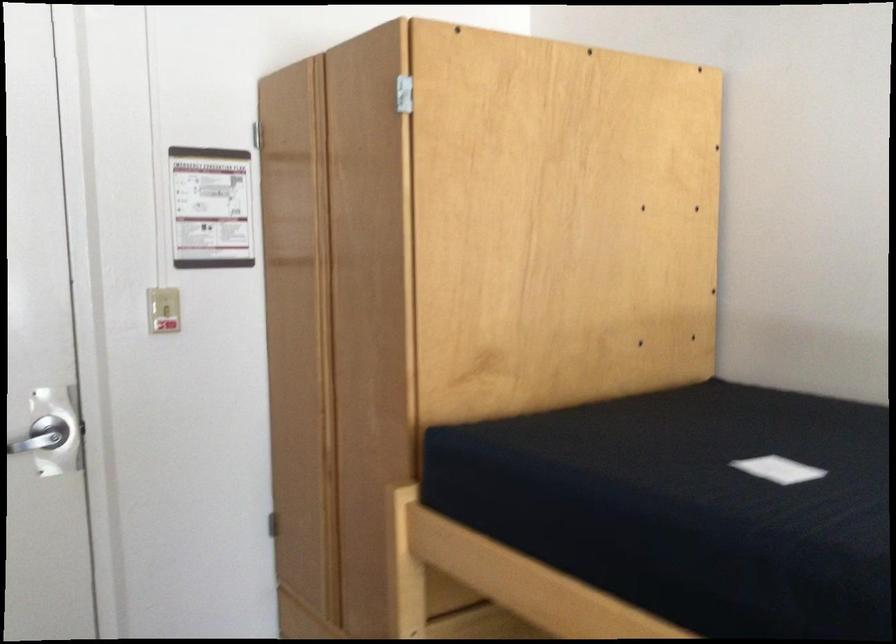
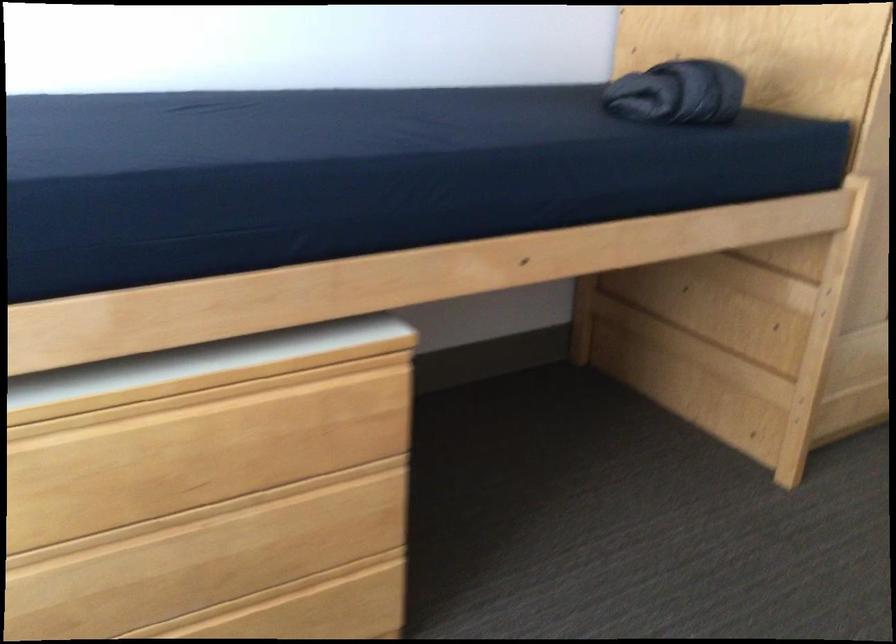
Consider the image. First-person continuous shooting, in which direction is the camera rotating?

The camera rotated toward left-down.